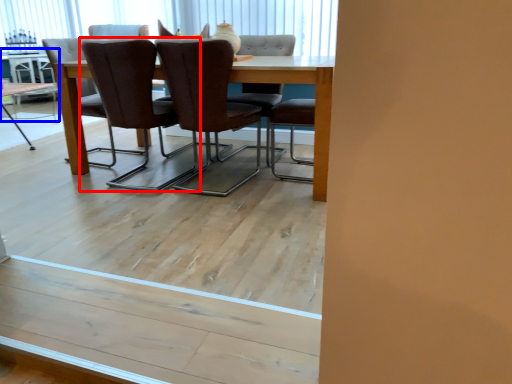
Question: Among these objects, which one is farthest to the camera, chair (highlighted by a red box) or table (highlighted by a blue box)?

Choices:
 (A) chair
 (B) table

Answer: (B)